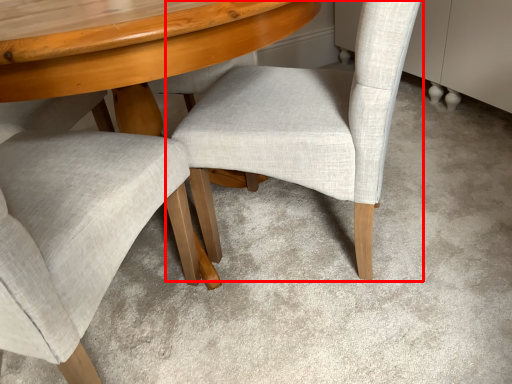
Question: Where is chair (annotated by the red box) located in relation to chair in the image?

Choices:
 (A) left
 (B) right

Answer: (B)